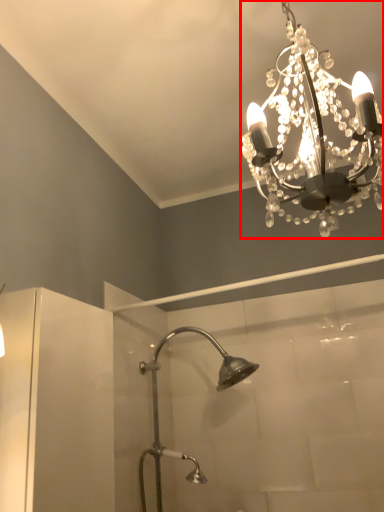
Question: From the image's perspective, what is the correct spatial relationship of lamp (annotated by the red box) in relation to shower?

Choices:
 (A) above
 (B) below

Answer: (A)